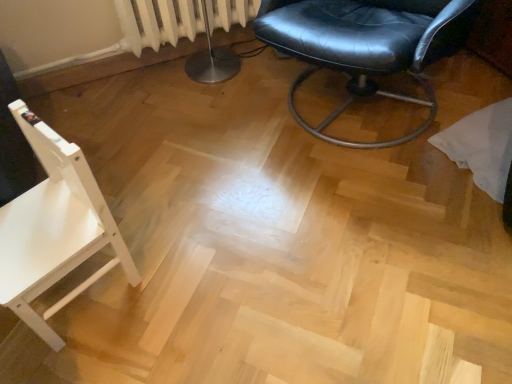
Find the location of a particular element. The image size is (512, 384). free region under black leather chair at center, which appears as the 1th chair when viewed from the top (from a real-world perspective) is located at coordinates (356, 104).